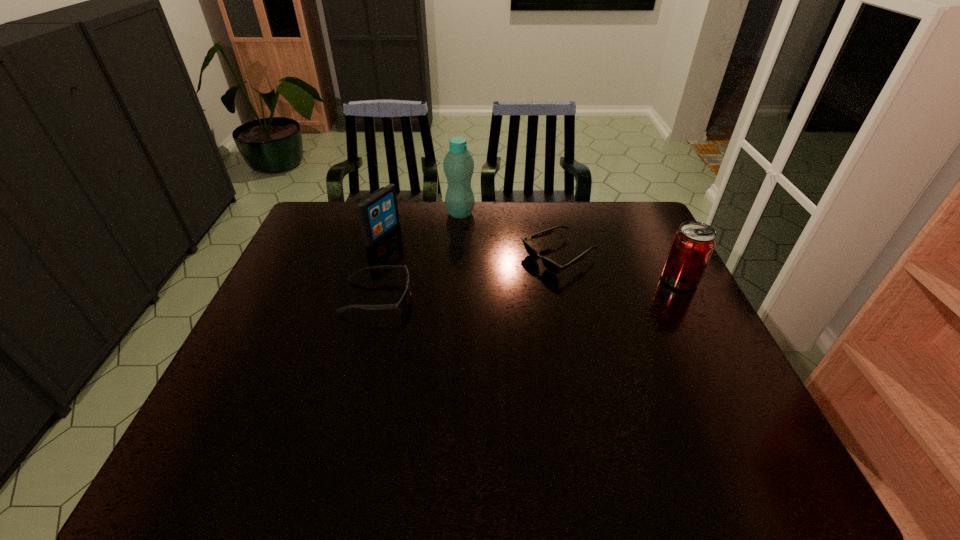
Locate an element on the screen. This screenshot has width=960, height=540. vacant space that satisfies the following two spatial constraints: 1. on the front side of the right sunglasses; 2. on the left side of the third object from left to right is located at coordinates (458, 257).

This screenshot has width=960, height=540. Identify the location of free spot that satisfies the following two spatial constraints: 1. on the front side of the third shortest object; 2. on the front-facing side of the left sunglasses. (364, 297).